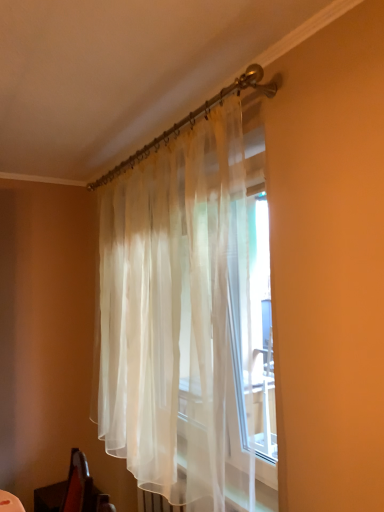
The width and height of the screenshot is (384, 512). What do you see at coordinates (180, 318) in the screenshot?
I see `translucent white curtain at upper center` at bounding box center [180, 318].

Find the location of `translucent white curtain at upper center`. translucent white curtain at upper center is located at coordinates (180, 318).

What is the approximate height of translucent white curtain at upper center?

translucent white curtain at upper center is 1.56 meters in height.

In order to face translucent white curtain at upper center, should I rotate leftwards or rightwards?

Rotate left and turn 6.760 degrees.

Measure the distance between point (98, 497) and camera.

The depth of point (98, 497) is 4.80 feet.

Image resolution: width=384 pixels, height=512 pixels. What do you see at coordinates (73, 490) in the screenshot?
I see `wooden swivel chair at lower left` at bounding box center [73, 490].

Image resolution: width=384 pixels, height=512 pixels. What are the coordinates of `wooden swivel chair at lower left` in the screenshot? It's located at (73, 490).

Image resolution: width=384 pixels, height=512 pixels. Identify the location of translucent white curtain at upper center. (180, 318).

Visually, is translucent white curtain at upper center positioned to the left or to the right of wooden swivel chair at lower left?

translucent white curtain at upper center is positioned on wooden swivel chair at lower left's right side.

Which object is more forward, translucent white curtain at upper center or wooden swivel chair at lower left?

Positioned in front is translucent white curtain at upper center.

Which is closer to the camera, (x=195, y=196) or (x=59, y=502)?

Point (x=195, y=196)

From the image's perspective, which is below, translucent white curtain at upper center or wooden swivel chair at lower left?

wooden swivel chair at lower left is shown below in the image.

From a real-world perspective, between translucent white curtain at upper center and wooden swivel chair at lower left, who is vertically higher?

translucent white curtain at upper center.

Which of these two, translucent white curtain at upper center or wooden swivel chair at lower left, is thinner?

Thinner between the two is translucent white curtain at upper center.

From their relative heights in the image, would you say translucent white curtain at upper center is taller or shorter than wooden swivel chair at lower left?

Considering their sizes, translucent white curtain at upper center has more height than wooden swivel chair at lower left.

Can you confirm if translucent white curtain at upper center is smaller than wooden swivel chair at lower left?

No.

In the scene shown: Can we say translucent white curtain at upper center lies outside wooden swivel chair at lower left?

translucent white curtain at upper center is positioned outside wooden swivel chair at lower left.

Is translucent white curtain at upper center not near wooden swivel chair at lower left?

That's not correct — translucent white curtain at upper center is a little close to wooden swivel chair at lower left.

Is translucent white curtain at upper center oriented towards wooden swivel chair at lower left?

No, translucent white curtain at upper center is not facing towards wooden swivel chair at lower left.

How many degrees apart are the facing directions of translucent white curtain at upper center and wooden swivel chair at lower left?

The angular difference between translucent white curtain at upper center and wooden swivel chair at lower left is 0.352 degrees.

The image size is (384, 512). In order to click on curtain in front of the wooden swivel chair at lower left in this screenshot , I will do `click(180, 318)`.

Considering the positions of objects wooden swivel chair at lower left and translucent white curtain at upper center in the image provided, who is more to the right, wooden swivel chair at lower left or translucent white curtain at upper center?

Positioned to the right is translucent white curtain at upper center.

Is wooden swivel chair at lower left further to camera compared to translucent white curtain at upper center?

Yes.

Does point (75, 449) come in front of point (218, 456)?

No, it is behind (218, 456).

From the image's perspective, which is below, wooden swivel chair at lower left or translucent white curtain at upper center?

wooden swivel chair at lower left appears lower in the image.

From a real-world perspective, relative to translucent white curtain at upper center, is wooden swivel chair at lower left vertically above or below?

wooden swivel chair at lower left is situated lower than translucent white curtain at upper center in the real world.

Which of these two, wooden swivel chair at lower left or translucent white curtain at upper center, is thinner?

translucent white curtain at upper center.

Who is taller, wooden swivel chair at lower left or translucent white curtain at upper center?

Standing taller between the two is translucent white curtain at upper center.

Between wooden swivel chair at lower left and translucent white curtain at upper center, which one has smaller size?

With smaller size is wooden swivel chair at lower left.

Is wooden swivel chair at lower left not inside translucent white curtain at upper center?

Yes, wooden swivel chair at lower left is not within translucent white curtain at upper center.

Does wooden swivel chair at lower left touch translucent white curtain at upper center?

No, wooden swivel chair at lower left is not making contact with translucent white curtain at upper center.

Is wooden swivel chair at lower left facing towards translucent white curtain at upper center?

No, wooden swivel chair at lower left is not facing towards translucent white curtain at upper center.

Measure the distance between wooden swivel chair at lower left and translucent white curtain at upper center.

They are 29.53 inches apart.

Image resolution: width=384 pixels, height=512 pixels. Find the location of `curtain above the wooden swivel chair at lower left (from a real-world perspective)`. curtain above the wooden swivel chair at lower left (from a real-world perspective) is located at coordinates (180, 318).

Where is `curtain that appears in front of the wooden swivel chair at lower left`? curtain that appears in front of the wooden swivel chair at lower left is located at coordinates (180, 318).

Where is `swivel chair behind the translucent white curtain at upper center`? The width and height of the screenshot is (384, 512). swivel chair behind the translucent white curtain at upper center is located at coordinates (73, 490).